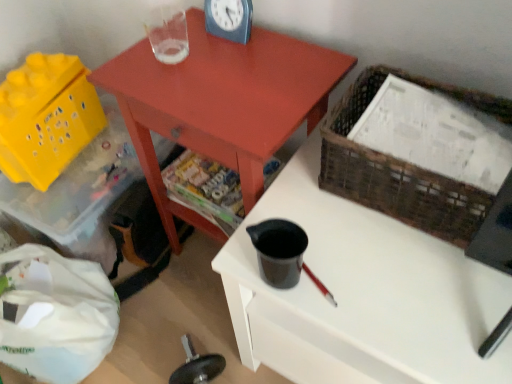
The height and width of the screenshot is (384, 512). I want to click on vacant point to the left of woven brown basket at upper right, which appears as the first basket when viewed from the right, so click(312, 220).